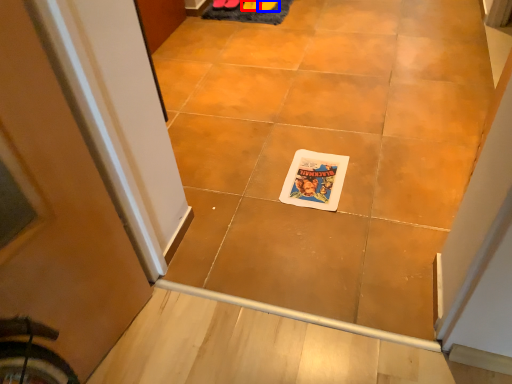
Question: Which object appears farthest to the camera in this image, footwear (highlighted by a red box) or footwear (highlighted by a blue box)?

Choices:
 (A) footwear
 (B) footwear

Answer: (A)